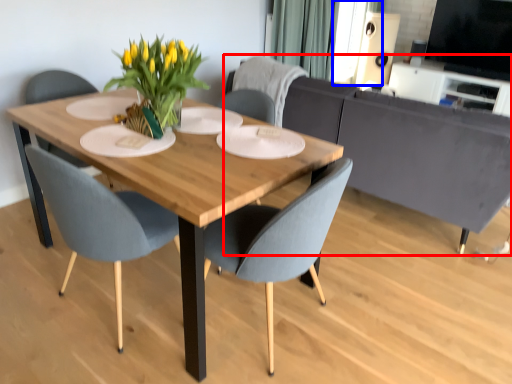
Question: Which of the following is the farthest to the observer, couch (highlighted by a red box) or window screen (highlighted by a blue box)?

Choices:
 (A) couch
 (B) window screen

Answer: (B)